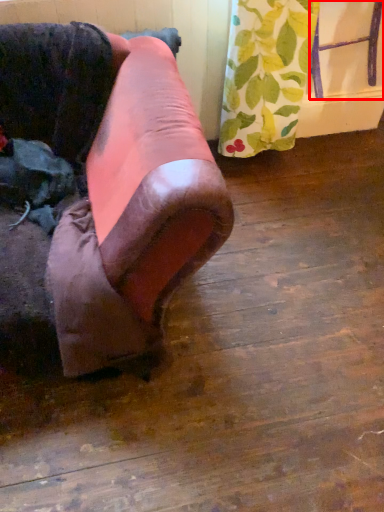
Question: From the image, what is the correct spatial relationship of furniture (annotated by the red box) in relation to furniture?

Choices:
 (A) left
 (B) right

Answer: (B)